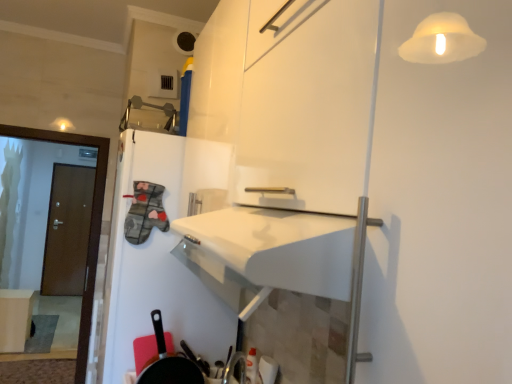
Question: Considering the positions of point (80, 379) and point (162, 354), is point (80, 379) closer or farther from the camera than point (162, 354)?

Choices:
 (A) closer
 (B) farther

Answer: (B)

Question: From their relative heights in the image, would you say brown wooden door at left is taller or shorter than black matte frying pan at lower left?

Choices:
 (A) tall
 (B) short

Answer: (A)

Question: Estimate the real-world distances between objects in this image. Which object is farther from the brown wooden door at left?

Choices:
 (A) black matte frying pan at lower left
 (B) brown wooden door at left
 (C) matte white table at lower left

Answer: (B)

Question: Which is farther from the brown wooden door at left?

Choices:
 (A) brown wooden door at left
 (B) black matte frying pan at lower left
 (C) matte white table at lower left

Answer: (B)